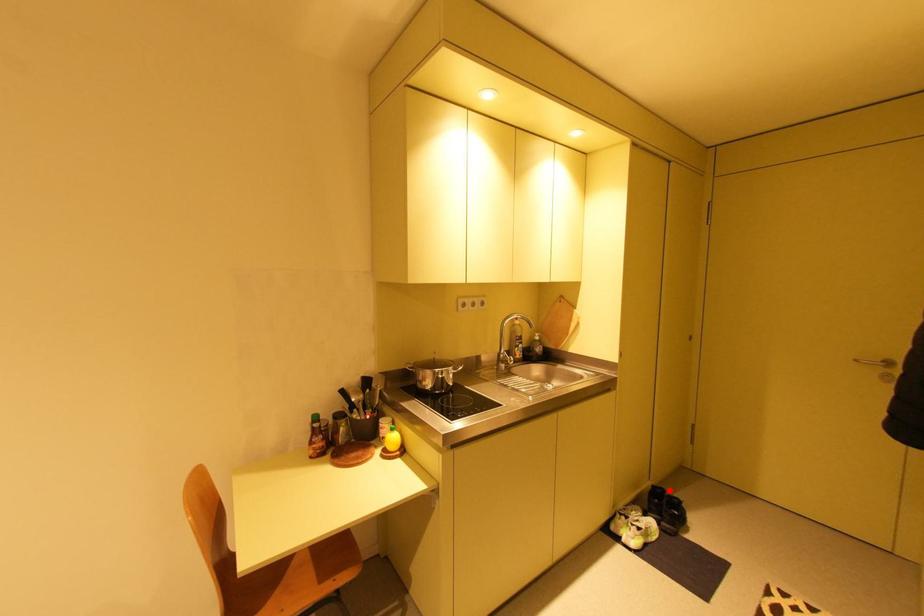
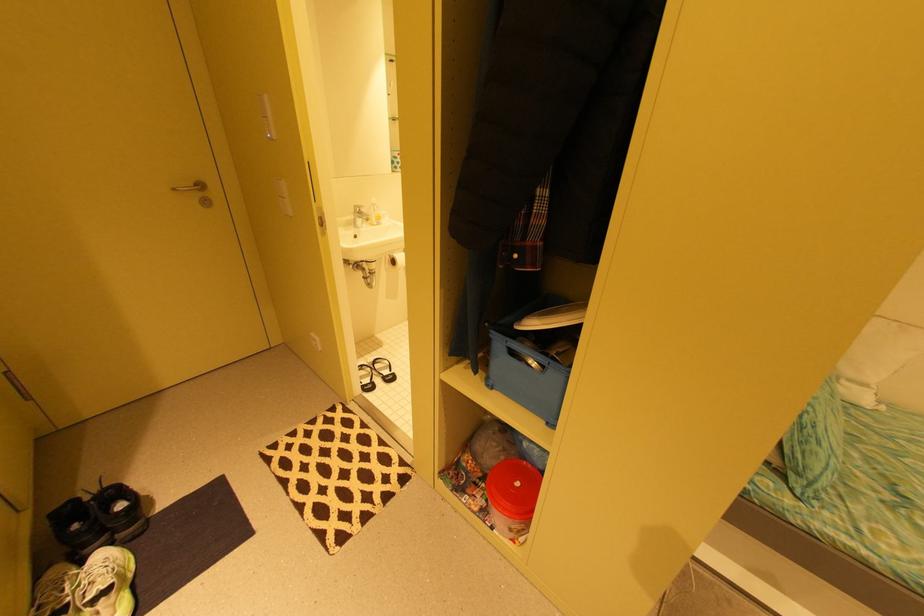
Locate, in the second image, the point that corresponds to the highlighted location in the first image.

(82, 501)